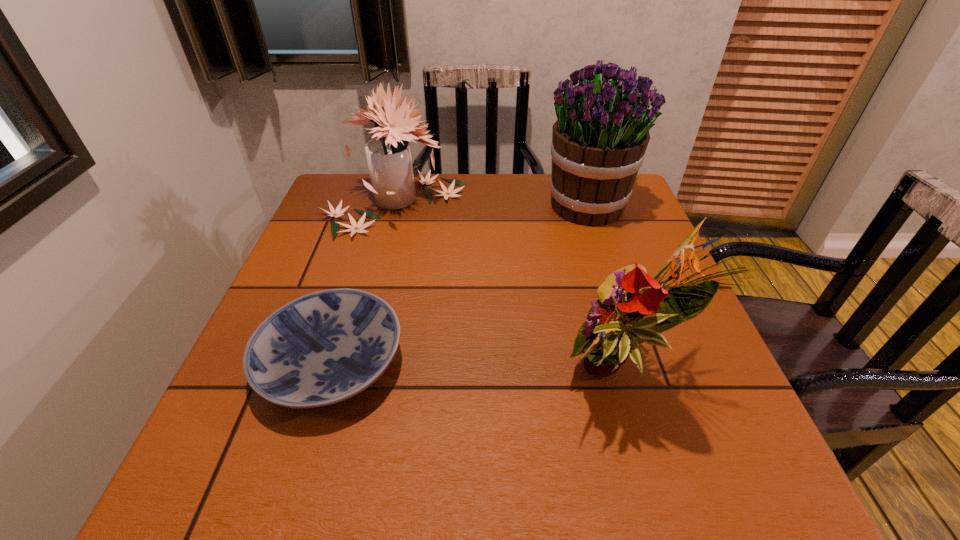
Where is `the tallest object`? the tallest object is located at coordinates (599, 140).

Find the location of `the leftmost bouquet`. the leftmost bouquet is located at coordinates (389, 158).

You are a GUI agent. You are given a task and a screenshot of the screen. Output one action in this format:
    pyautogui.click(x=<x>, y=<y>)
    Task: Click on the nearest bouquet
    The width and height of the screenshot is (960, 540).
    Given the screenshot: What is the action you would take?
    pyautogui.click(x=632, y=308)

Identify the location of the shortest object. The image size is (960, 540). point(322,348).

Where is `vacant region located on the left of the tallest bouquet`? This screenshot has width=960, height=540. vacant region located on the left of the tallest bouquet is located at coordinates (451, 207).

The width and height of the screenshot is (960, 540). What are the coordinates of `free location located 0.400m on the front of the leftmost bouquet` in the screenshot? It's located at (349, 379).

Where is `vacant position located on the front-facing side of the nearest bouquet`? This screenshot has height=540, width=960. vacant position located on the front-facing side of the nearest bouquet is located at coordinates (436, 376).

You are a GUI agent. You are given a task and a screenshot of the screen. Output one action in this format:
    pyautogui.click(x=<x>, y=<y>)
    Task: Click on the free location located 0.370m on the front-facing side of the nearest bouquet
    This screenshot has height=540, width=960.
    Given the screenshot: What is the action you would take?
    pyautogui.click(x=347, y=376)

Locate an element on the screen. The height and width of the screenshot is (540, 960). vacant region located on the front-facing side of the nearest bouquet is located at coordinates (402, 376).

This screenshot has height=540, width=960. Identify the location of vacant space located 0.180m on the right of the shortest object. (501, 363).